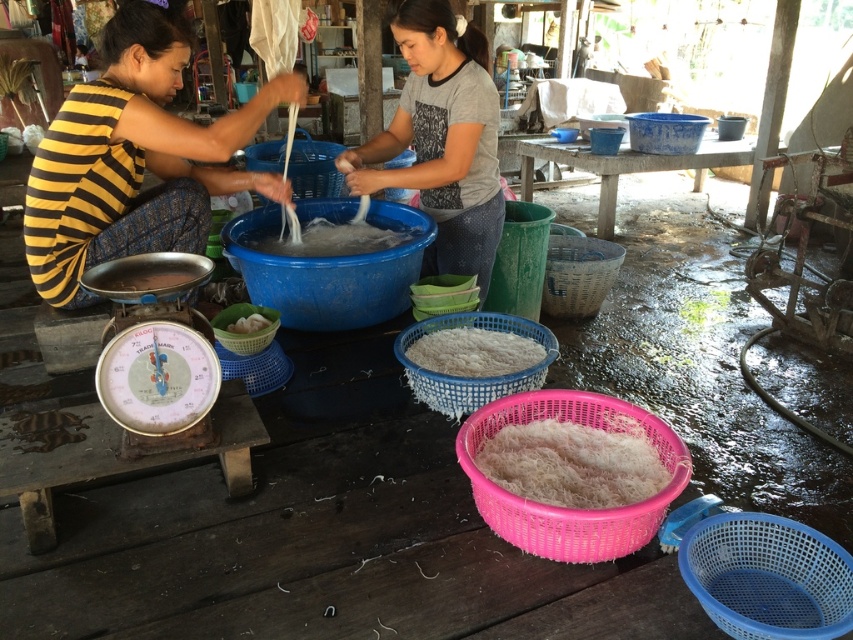
You are a customer observing the two women at the table. You notice the yellow striped fabric at left and the metallic scale at lower left. Which object is larger in size?

The yellow striped fabric at left is bigger than the metallic scale at lower left according to the description.

You are observing the two women preparing noodles. The woman on the left is wearing a yellow and black striped sleeveless top. Where is the yellow striped fabric at left in relation to the woman on the left?

The yellow striped fabric at left is located at point (135, 157) relative to the woman on the left.